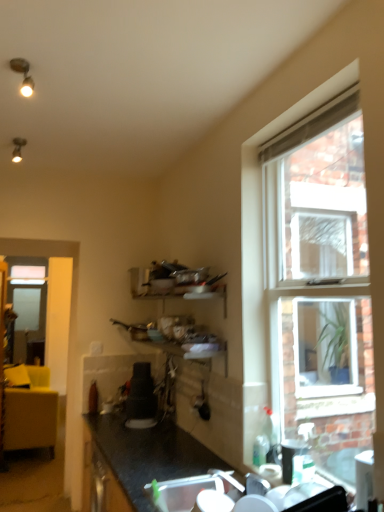
Question: From the image's perspective, relative to satin black coffee maker at center, marked as the 1th appliance in a left-to-right arrangement, is transparent glass screen door at left above or below?

Choices:
 (A) below
 (B) above

Answer: (A)

Question: Is transparent glass screen door at left in front of or behind satin black coffee maker at center, which appears as the second appliance when viewed from the front, in the image?

Choices:
 (A) front
 (B) behind

Answer: (B)

Question: Based on their relative distances, which object is nearer to the black plastic cup at lower right, which is the second appliance from left to right?

Choices:
 (A) clear glass window at right
 (B) satin black coffee maker at center, which appears as the second appliance when viewed from the front
 (C) transparent glass screen door at left
 (D) white plastic sink at lower center

Answer: (D)

Question: Which object is positioned farthest from the black plastic cup at lower right, the first appliance in the right-to-left sequence?

Choices:
 (A) satin black coffee maker at center, the 2th appliance when ordered from right to left
 (B) transparent glass screen door at left
 (C) clear glass window at right
 (D) white plastic sink at lower center

Answer: (B)